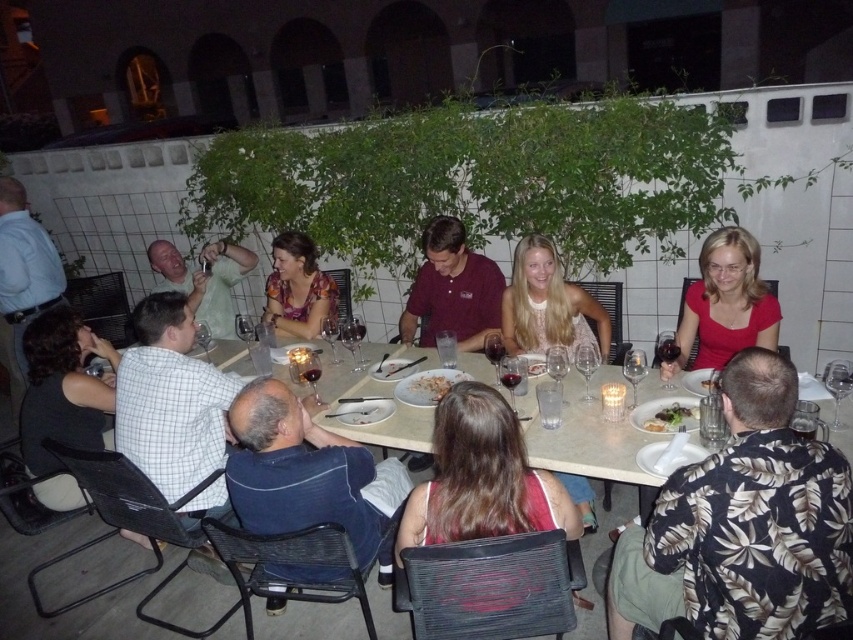
From the picture: You are a photographer at the event and want to capture a photo of the two people wearing the floral print shirt at lower right and the matte floral dress at center. Since the camera can only focus on one subject at a time, which person should you focus on first to ensure they are in the frame?

The floral print shirt at lower right is positioned on the right side of the matte floral dress at center, so you should focus on the matte floral dress at center first as it is closer to the camera.

You are a server at a restaurant and need to place a new dessert plate on the table. The dessert plate is the same size as the white glossy plate at lower right. Based on the scene, can you fit the dessert plate on the white glossy table at center without removing any existing items?

The white glossy table at center is larger in size than the white glossy plate at lower right, so there should be enough space to place the dessert plate on the table without removing existing items.